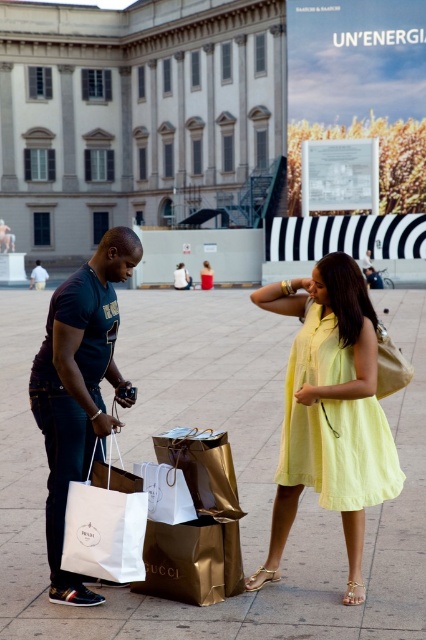
You are a delivery person who needs to place both the gold metallic shopping bag at center and the white paper bag at lower left into your truck. Which bag should you load first if you want to maximize space efficiency?

The gold metallic shopping bag at center is bigger than the white paper bag at lower left, so you should load the gold metallic shopping bag at center first to maximize space efficiency by placing larger items first.